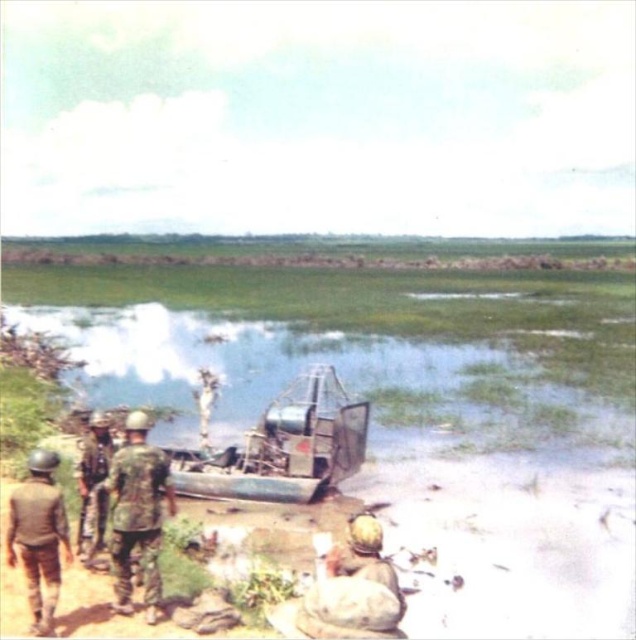
Question: In this image, where is camouflage fabric uniform at left located relative to camouflage fabric helmet at lower right?

Choices:
 (A) left
 (B) right

Answer: (A)

Question: Does camouflage fabric helmet at lower right have a smaller size compared to camouflage fabric helmet at lower left?

Choices:
 (A) no
 (B) yes

Answer: (A)

Question: Which object appears closest to the camera in this image?

Choices:
 (A) camouflage fabric helmet at lower left
 (B) camouflage fabric helmet at left
 (C) green grassy water at center
 (D) rusty metal boat at center

Answer: (A)

Question: Observing the image, what is the correct spatial positioning of camouflage fabric helmet at lower left in reference to camouflage fabric helmet at left?

Choices:
 (A) above
 (B) below

Answer: (B)

Question: Which object is the closest to the camouflage fabric uniform at left?

Choices:
 (A) camouflage fabric helmet at lower left
 (B) camouflage fabric helmet at left
 (C) camouflage fabric helmet at lower right
 (D) rusty metal boat at center

Answer: (A)

Question: Which is farther from the camouflage fabric uniform at left?

Choices:
 (A) rusty metal boat at center
 (B) camouflage fabric helmet at lower left
 (C) camouflage fabric helmet at lower right

Answer: (A)